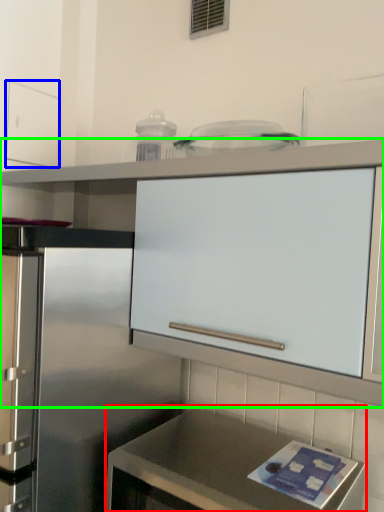
Question: Based on their relative distances, which object is farther from countertop (highlighted by a red box)? Choose from drawer (highlighted by a blue box) and cabinetry (highlighted by a green box).

Choices:
 (A) drawer
 (B) cabinetry

Answer: (A)